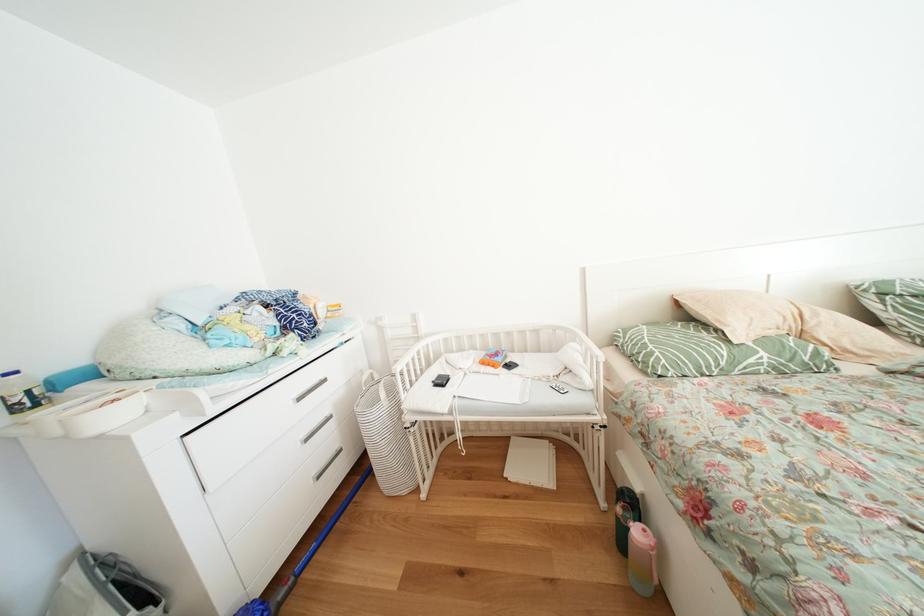
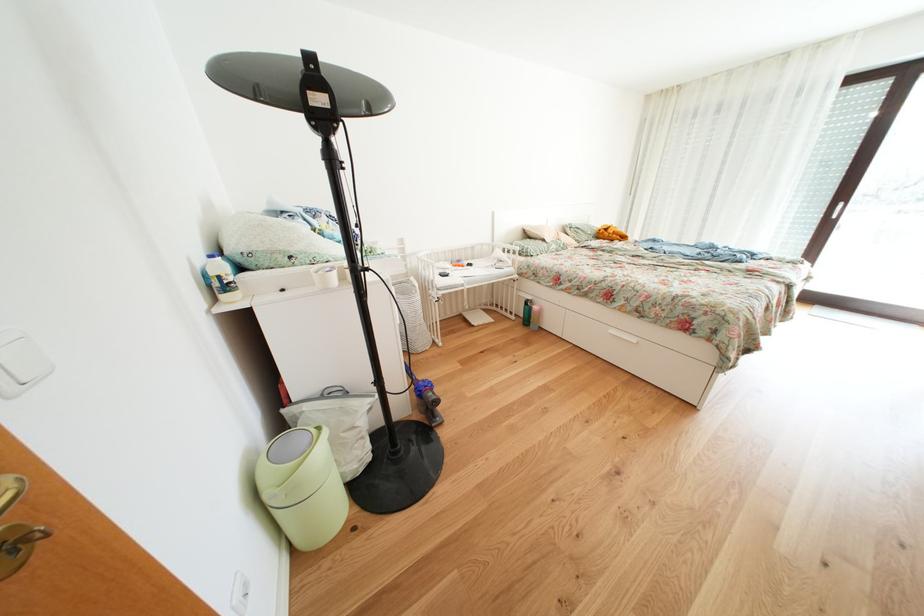
Locate, in the second image, the point that corresponds to (x=641, y=508) in the first image.

(541, 307)